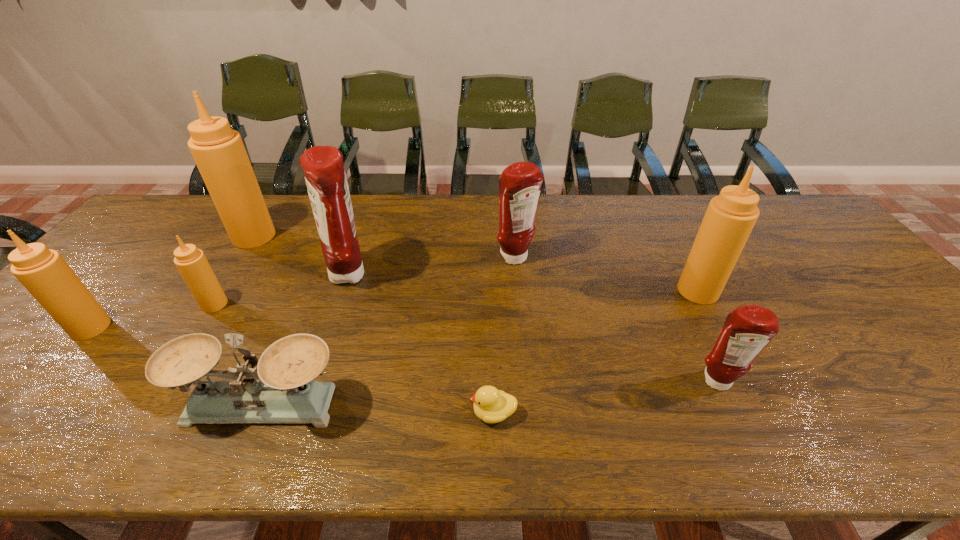
Where is `the rightmost red condiment`? This screenshot has width=960, height=540. the rightmost red condiment is located at coordinates point(747,330).

What are the coordinates of `the nearest red condiment` in the screenshot? It's located at (747, 330).

Image resolution: width=960 pixels, height=540 pixels. What are the coordinates of `scale` in the screenshot? It's located at (286, 393).

Identify the location of yellow duckling. pyautogui.click(x=491, y=405).

I want to click on the shortest object, so click(x=491, y=405).

Where is `free space located 0.180m on the right of the tallest object`? This screenshot has width=960, height=540. free space located 0.180m on the right of the tallest object is located at coordinates (331, 236).

Find the location of `vacant area situated 0.070m on the back of the fourth condiment from left to right`. vacant area situated 0.070m on the back of the fourth condiment from left to right is located at coordinates (359, 243).

Identify the location of free space located 0.080m on the front of the third smallest tan condiment. (717, 328).

You are a GUI agent. You are given a task and a screenshot of the screen. Output one action in this format:
    pyautogui.click(x=<x>, y=<y>)
    Task: Click on the vacant space positioned 0.170m on the front of the leftmost object
    Image resolution: width=960 pixels, height=540 pixels.
    Given the screenshot: What is the action you would take?
    pyautogui.click(x=26, y=402)

At what (x,y) coordinates should I click in order to perform the action: click on blank space located 0.400m on the right of the fifth condiment from left to right. Please return your answer as a coordinate pair (x, y). This screenshot has width=960, height=540. Looking at the image, I should click on (670, 258).